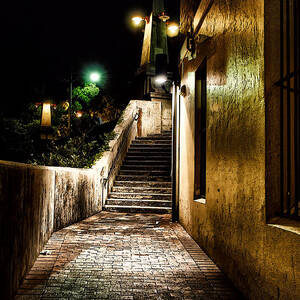
Locate an element on the screen. windows is located at coordinates (299, 140), (206, 134).